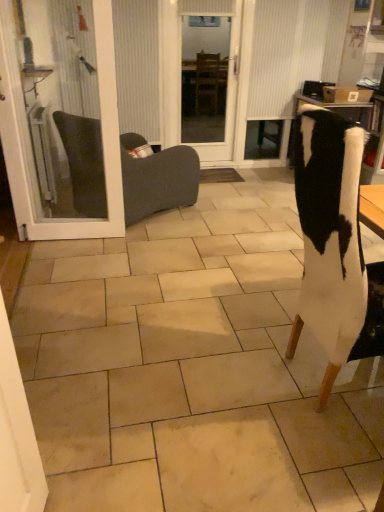
This screenshot has height=512, width=384. I want to click on free space in front of dark gray fabric chair at left, which is the 1th chair in back-to-front order, so click(124, 254).